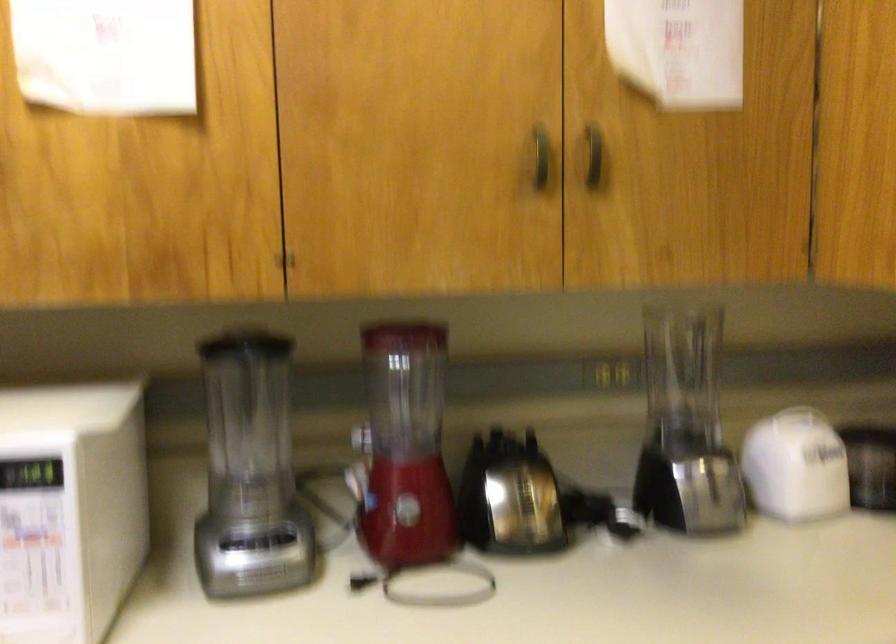
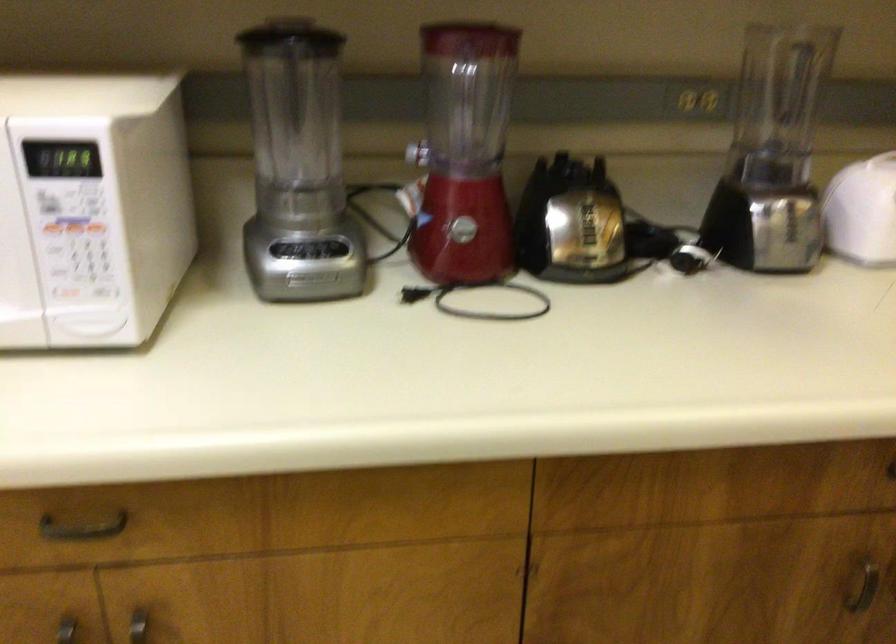
Locate, in the second image, the point that corresponds to the point at 261,573 in the first image.

(309, 278)